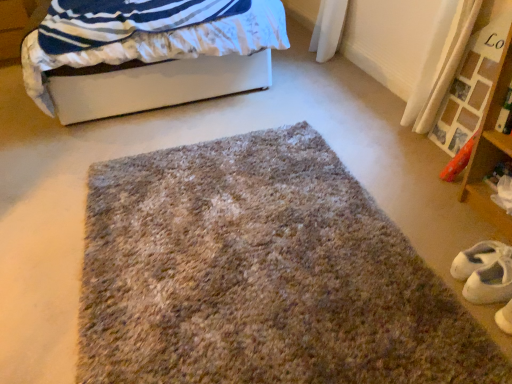
Measure the distance between point (265, 24) and camera.

Point (265, 24) and camera are 8.18 feet apart from each other.

What are the coordinates of `white smooth bed at upper left` in the screenshot? It's located at (152, 61).

How different are the orientations of fuzzy carpet at center and white suede shoe at lower right in degrees?

The facing directions of fuzzy carpet at center and white suede shoe at lower right are 91.1 degrees apart.

From a real-world perspective, is fuzzy carpet at center positioned over white suede shoe at lower right based on gravity?

Incorrect, from a real-world perspective, fuzzy carpet at center is lower than white suede shoe at lower right.

Considering their positions, is fuzzy carpet at center located in front of or behind white suede shoe at lower right?

fuzzy carpet at center is positioned closer to the viewer than white suede shoe at lower right.

Is fuzzy carpet at center not within white suede shoe at lower right?

fuzzy carpet at center is positioned outside white suede shoe at lower right.

Measure the distance from wooden shelf at right to white suede shoe at lower right.

wooden shelf at right and white suede shoe at lower right are 15.99 inches apart.

Is wooden shelf at right beside white suede shoe at lower right?

No, wooden shelf at right is not in contact with white suede shoe at lower right.

Considering the positions of objects wooden shelf at right and white suede shoe at lower right in the image provided, who is more to the right, wooden shelf at right or white suede shoe at lower right?

Positioned to the right is wooden shelf at right.

Could white suede shoe at lower right be considered to be inside wooden shelf at right?

No, white suede shoe at lower right is not inside wooden shelf at right.

Looking at their sizes, would you say white suede shoe at lower right is wider or thinner than white smooth bed at upper left?

A: white suede shoe at lower right is thinner than white smooth bed at upper left.

Identify the location of shoe in front of the white smooth bed at upper left. The height and width of the screenshot is (384, 512). (487, 277).

Does white suede shoe at lower right lie in front of white smooth bed at upper left?

Yes, white suede shoe at lower right is closer to the viewer.

From a real-world perspective, is white smooth bed at upper left physically above fuzzy carpet at center?

Yes, from a real-world perspective, white smooth bed at upper left is on top of fuzzy carpet at center.

Does point (131, 78) come in front of point (207, 231)?

No.

Considering the relative positions of white smooth bed at upper left and fuzzy carpet at center in the image provided, is white smooth bed at upper left to the right of fuzzy carpet at center from the viewer's perspective?

In fact, white smooth bed at upper left is to the left of fuzzy carpet at center.

Is white smooth bed at upper left positioned far away from fuzzy carpet at center?

Yes, white smooth bed at upper left is far from fuzzy carpet at center.

Would you say white smooth bed at upper left is inside or outside wooden shelf at right?

white smooth bed at upper left lies outside wooden shelf at right.

Is white smooth bed at upper left positioned in front of wooden shelf at right?

No, white smooth bed at upper left is further to the viewer.

Based on their positions, is white smooth bed at upper left located to the left or right of wooden shelf at right?

In the image, white smooth bed at upper left appears on the left side of wooden shelf at right.

Which point is more forward, (260, 21) or (479, 212)?

The point (479, 212) is closer.

Where is `mat above the white suede shoe at lower right (from the image's perspective)`? mat above the white suede shoe at lower right (from the image's perspective) is located at coordinates (261, 275).

From the image's perspective, is white suede shoe at lower right located above or below fuzzy carpet at center?

From the image's perspective, white suede shoe at lower right appears below fuzzy carpet at center.

Is white suede shoe at lower right located outside fuzzy carpet at center?

white suede shoe at lower right lies outside fuzzy carpet at center's area.

Does point (484, 280) appear closer or farther from the camera than point (218, 341)?

Point (484, 280) appears to be farther away from the viewer than point (218, 341).

Is wooden shelf at right to the left of white smooth bed at upper left from the viewer's perspective?

No, wooden shelf at right is not to the left of white smooth bed at upper left.

Between wooden shelf at right and white smooth bed at upper left, which one has smaller width?

Thinner between the two is wooden shelf at right.

Is point (490, 140) positioned in front of point (170, 17)?

Yes, it is.

In terms of size, does wooden shelf at right appear bigger or smaller than white smooth bed at upper left?

Clearly, wooden shelf at right is smaller in size than white smooth bed at upper left.

This screenshot has height=384, width=512. Find the location of `shoe that appears below the fuzzy carpet at center (from the image's perspective)`. shoe that appears below the fuzzy carpet at center (from the image's perspective) is located at coordinates (487, 277).

Locate an element on the screen. The height and width of the screenshot is (384, 512). shoe behind the wooden shelf at right is located at coordinates (487, 277).

Estimate the real-world distances between objects in this image. Which object is further from wooden shelf at right, white smooth bed at upper left or white suede shoe at lower right?

Among the two, white smooth bed at upper left is located further to wooden shelf at right.

Based on their spatial positions, is white smooth bed at upper left or fuzzy carpet at center closer to wooden shelf at right?

Based on the image, fuzzy carpet at center appears to be nearer to wooden shelf at right.

Based on their spatial positions, is wooden shelf at right or white suede shoe at lower right closer to white smooth bed at upper left?

wooden shelf at right lies closer to white smooth bed at upper left than the other object.

Estimate the real-world distances between objects in this image. Which object is further from white smooth bed at upper left, wooden shelf at right or fuzzy carpet at center?

Among the two, wooden shelf at right is located further to white smooth bed at upper left.

From the image, which object appears to be nearer to fuzzy carpet at center, white smooth bed at upper left or wooden shelf at right?

wooden shelf at right is closer to fuzzy carpet at center.

Based on their spatial positions, is white smooth bed at upper left or wooden shelf at right closer to white suede shoe at lower right?

wooden shelf at right is positioned closer to the anchor white suede shoe at lower right.

Which object lies further to the anchor point fuzzy carpet at center, wooden shelf at right or white smooth bed at upper left?

Among the two, white smooth bed at upper left is located further to fuzzy carpet at center.

When comparing their distances from white suede shoe at lower right, does wooden shelf at right or fuzzy carpet at center seem closer?

wooden shelf at right lies closer to white suede shoe at lower right than the other object.

Locate an element on the screen. Image resolution: width=512 pixels, height=384 pixels. mat between white smooth bed at upper left and wooden shelf at right from left to right is located at coordinates (261, 275).

Find the location of a particular element. The image size is (512, 384). shoe situated between fuzzy carpet at center and wooden shelf at right from left to right is located at coordinates (487, 277).

The width and height of the screenshot is (512, 384). Find the location of `mat between white smooth bed at upper left and white suede shoe at lower right from top to bottom`. mat between white smooth bed at upper left and white suede shoe at lower right from top to bottom is located at coordinates (261, 275).

I want to click on shoe between white smooth bed at upper left and wooden shelf at right, so click(487, 277).